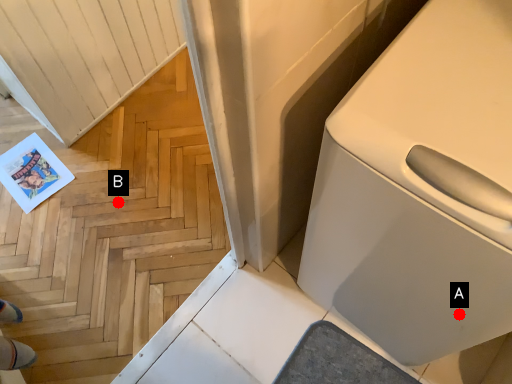
Question: Two points are circled on the image, labeled by A and B beside each circle. Which point appears farthest from the camera in this image?

Choices:
 (A) A is further
 (B) B is further

Answer: (B)